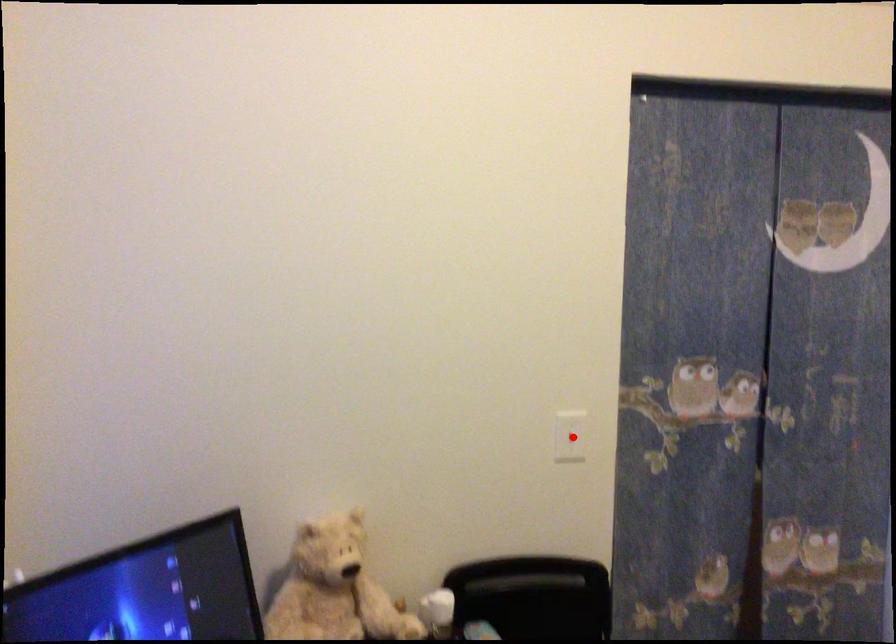
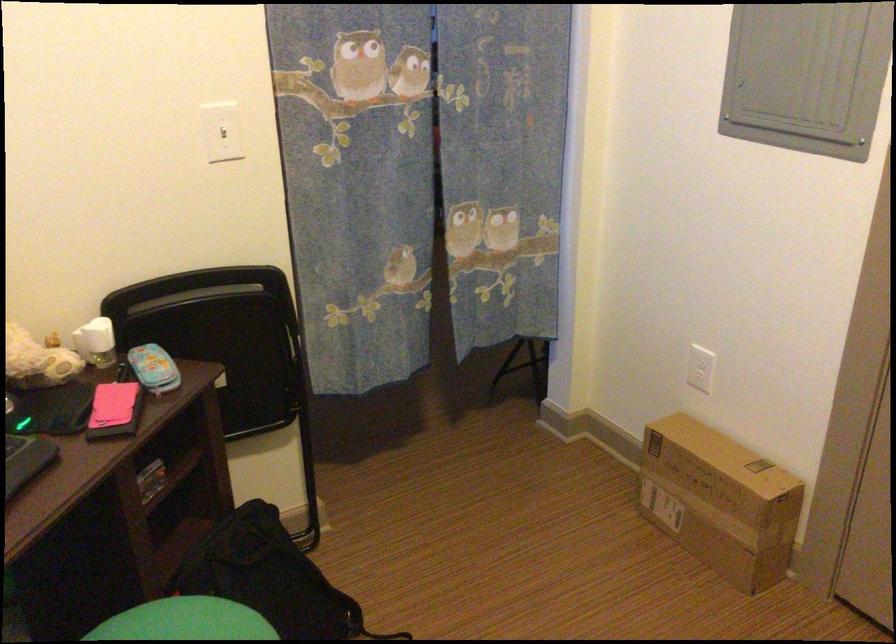
The point at the highlighted location is marked in the first image. Where is the corresponding point in the second image?

(222, 131)